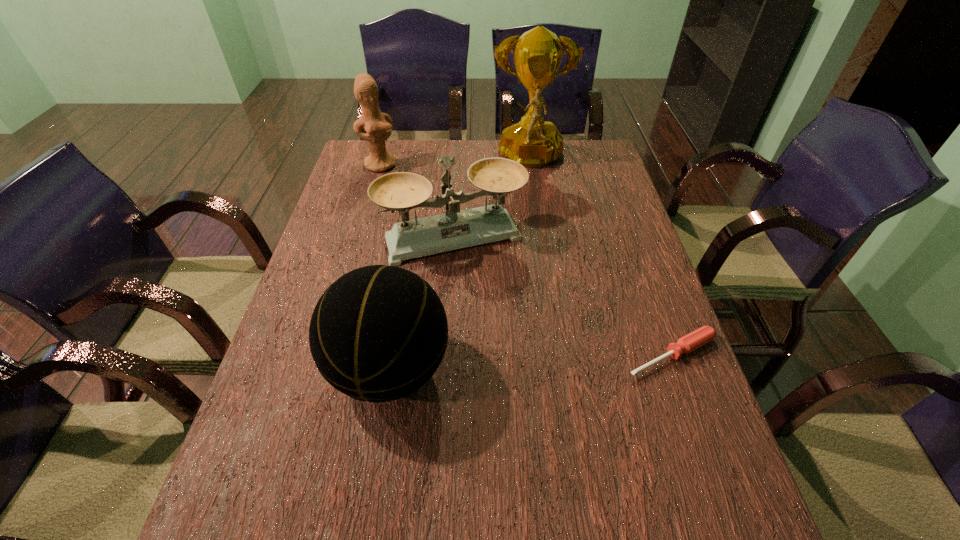
Identify the location of figurine present at the left edge. The image size is (960, 540). (377, 125).

Locate an element on the screen. This screenshot has height=540, width=960. screwdriver that is positioned at the right edge is located at coordinates (694, 340).

Where is `award at the right edge`? award at the right edge is located at coordinates pos(532,142).

What are the coordinates of `object present at the far left corner` in the screenshot? It's located at (377, 125).

Locate an element on the screen. The image size is (960, 540). object positioned at the far right corner is located at coordinates (532, 142).

You are a GUI agent. You are given a task and a screenshot of the screen. Output one action in this format:
    pyautogui.click(x=<x>, y=<y>)
    Task: Click on the vacant space at the far edge
    The width and height of the screenshot is (960, 540).
    Given the screenshot: What is the action you would take?
    pyautogui.click(x=496, y=145)

I want to click on vacant region at the left edge of the desktop, so click(293, 437).

The image size is (960, 540). In order to click on vacant space at the right edge of the desktop in this screenshot , I will do `click(633, 219)`.

The image size is (960, 540). Find the location of `free location at the far left corner of the desktop`. free location at the far left corner of the desktop is located at coordinates (361, 146).

You are a GUI agent. You are given a task and a screenshot of the screen. Output one action in this format:
    pyautogui.click(x=<x>, y=<y>)
    Task: Click on the vacant space at the near left corner of the desktop
    The image size is (960, 540).
    Given the screenshot: What is the action you would take?
    pyautogui.click(x=289, y=447)